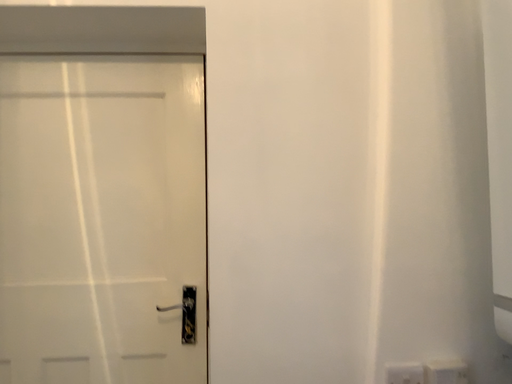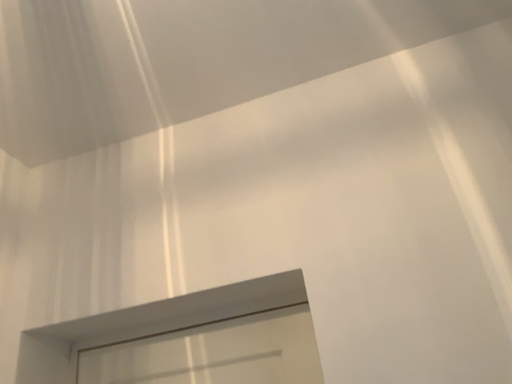
Question: Which way did the camera rotate in the video?

Choices:
 (A) rotated downward
 (B) rotated upward

Answer: (B)